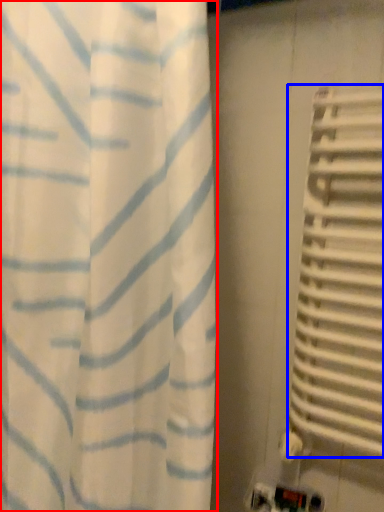
Question: Which object is closer to the camera taking this photo, curtain (highlighted by a red box) or blind (highlighted by a blue box)?

Choices:
 (A) curtain
 (B) blind

Answer: (A)